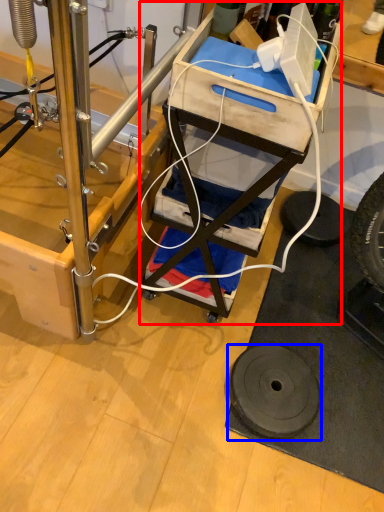
Question: Which point is further to the camera, furniture (highlighted by a red box) or wheel (highlighted by a blue box)?

Choices:
 (A) furniture
 (B) wheel

Answer: (B)